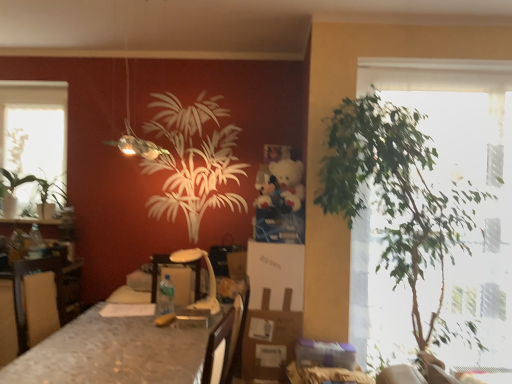
Question: Is green leafy plant at left, which appears as the second houseplant when viewed from the right, in front of or behind marble-patterned table at center in the image?

Choices:
 (A) front
 (B) behind

Answer: (B)

Question: Visually, is green leafy plant at left, which appears as the first houseplant when viewed from the back, positioned to the left or to the right of marble-patterned table at center?

Choices:
 (A) right
 (B) left

Answer: (B)

Question: Estimate the real-world distances between objects in this image. Which object is farther from the marble-patterned table at center?

Choices:
 (A) green leafy plant at right, which ranks as the first houseplant in front-to-back order
 (B) green leafy plant at left, the second houseplant viewed from the front
 (C) clear glass window at upper left
 (D) green leafy plant at left

Answer: (D)

Question: Which object is positioned closest to the clear glass window at upper left?

Choices:
 (A) green leafy plant at left
 (B) marble-patterned table at center
 (C) green leafy plant at left, the second houseplant viewed from the front
 (D) green leafy plant at right, the 2th houseplant in the left-to-right sequence

Answer: (A)